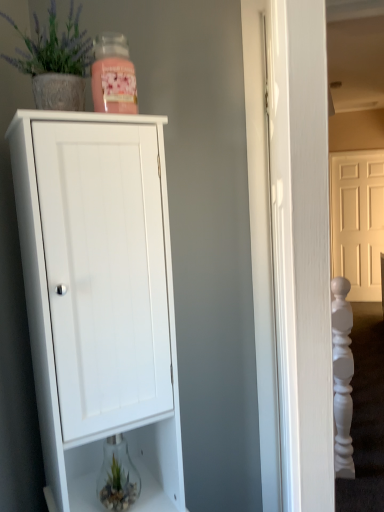
Question: From a real-world perspective, is yellow matte door at upper right under clear glass vase at lower center?

Choices:
 (A) no
 (B) yes

Answer: (A)

Question: Is yellow matte door at upper right further to camera compared to clear glass vase at lower center?

Choices:
 (A) no
 (B) yes

Answer: (B)

Question: Does yellow matte door at upper right have a smaller size compared to clear glass vase at lower center?

Choices:
 (A) no
 (B) yes

Answer: (A)

Question: Does yellow matte door at upper right have a greater height compared to clear glass vase at lower center?

Choices:
 (A) no
 (B) yes

Answer: (B)

Question: Is yellow matte door at upper right at the right side of clear glass vase at lower center?

Choices:
 (A) no
 (B) yes

Answer: (B)

Question: Would you say matte gray pot at upper left is to the left or to the right of yellow matte door at upper right in the picture?

Choices:
 (A) right
 (B) left

Answer: (B)

Question: In terms of width, does matte gray pot at upper left look wider or thinner when compared to yellow matte door at upper right?

Choices:
 (A) wide
 (B) thin

Answer: (A)

Question: From a real-world perspective, is matte gray pot at upper left above or below yellow matte door at upper right?

Choices:
 (A) below
 (B) above

Answer: (B)

Question: Considering the positions of point tap(72, 47) and point tap(367, 228), is point tap(72, 47) closer or farther from the camera than point tap(367, 228)?

Choices:
 (A) farther
 (B) closer

Answer: (B)

Question: Based on their positions, is matte gray pot at upper left located to the left or right of white matte cabinet at center?

Choices:
 (A) left
 (B) right

Answer: (A)

Question: Does point (72, 69) appear closer or farther from the camera than point (59, 370)?

Choices:
 (A) farther
 (B) closer

Answer: (A)

Question: Is matte gray pot at upper left spatially inside white matte cabinet at center, or outside of it?

Choices:
 (A) inside
 (B) outside

Answer: (B)

Question: From a real-world perspective, is matte gray pot at upper left above or below white matte cabinet at center?

Choices:
 (A) below
 (B) above

Answer: (B)

Question: From the image's perspective, is matte gray pot at upper left above or below clear glass vase at lower center?

Choices:
 (A) below
 (B) above

Answer: (B)

Question: From a real-world perspective, is matte gray pot at upper left positioned above or below clear glass vase at lower center?

Choices:
 (A) below
 (B) above

Answer: (B)